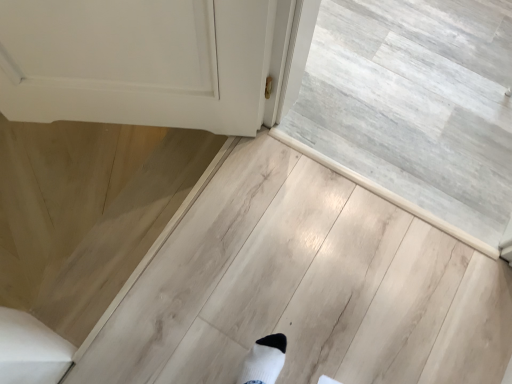
What are the coordinates of `light wood stairwell at lower left` in the screenshot? It's located at (416, 103).

Describe the element at coordinates (416, 103) in the screenshot. I see `light wood stairwell at lower left` at that location.

Locate an element on the screen. light wood stairwell at lower left is located at coordinates (416, 103).